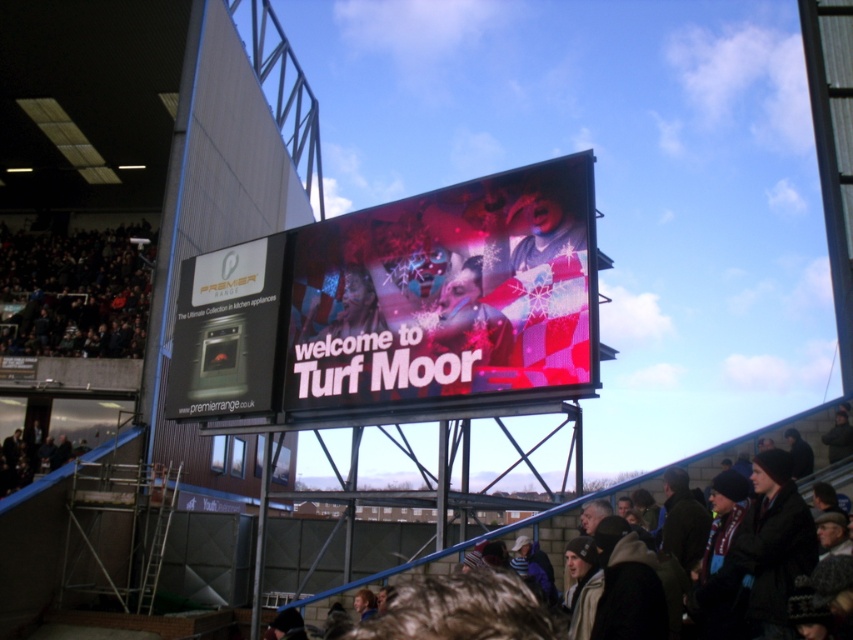
Question: Is shiny digital screen at center bigger than dark brown fabric at upper left?

Choices:
 (A) no
 (B) yes

Answer: (A)

Question: Which object is farther from the camera taking this photo?

Choices:
 (A) matte black oven at center-left
 (B) dark brown fabric at upper left

Answer: (B)

Question: Is dark brown fabric at upper left below shiny metallic helmet at center?

Choices:
 (A) no
 (B) yes

Answer: (A)

Question: Which object is the closest to the matte black oven at center-left?

Choices:
 (A) shiny digital screen at center
 (B) dark brown leather jacket at lower left

Answer: (A)

Question: Can you confirm if shiny digital screen at center is thinner than dark brown leather jacket at lower left?

Choices:
 (A) yes
 (B) no

Answer: (B)

Question: Which point is farther to the camera?

Choices:
 (A) dark brown fabric at upper left
 (B) matte black oven at center-left
 (C) dark brown leather jacket at lower left

Answer: (A)